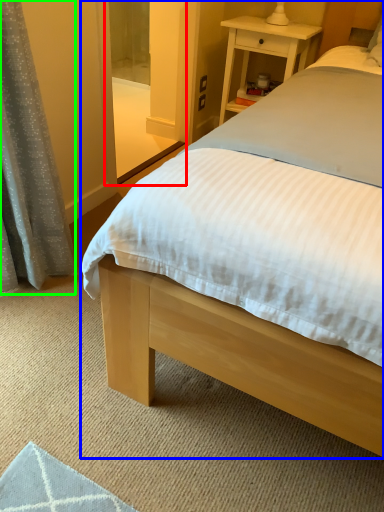
Question: Which is nearer to the screen door (highlighted by a red box)? bed (highlighted by a blue box) or curtain (highlighted by a green box).

Choices:
 (A) bed
 (B) curtain

Answer: (A)